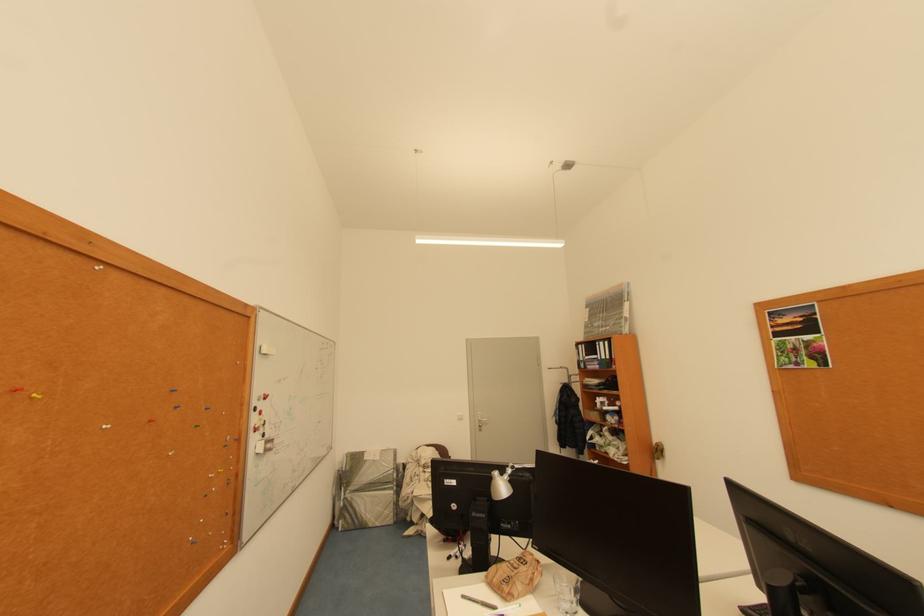
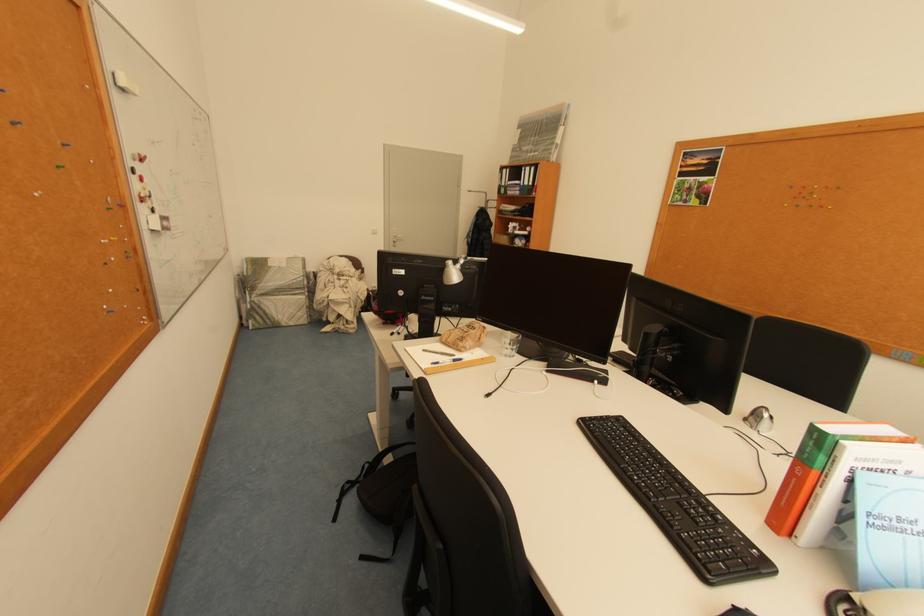
The point at (264,428) is marked in the first image. Where is the corresponding point in the second image?

(151, 197)